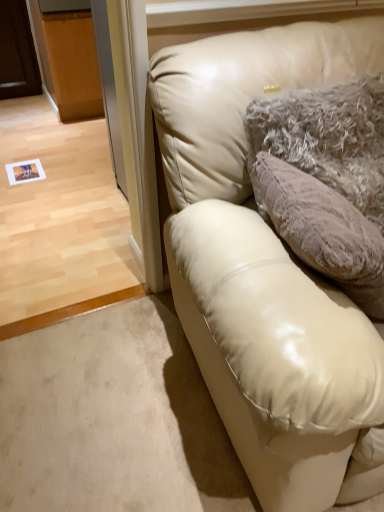
Question: Is fuzzy beige pillow at upper right to the left or to the right of matte cream leather couch at upper right in the image?

Choices:
 (A) left
 (B) right

Answer: (A)

Question: From their relative heights in the image, would you say fuzzy beige pillow at upper right is taller or shorter than matte cream leather couch at upper right?

Choices:
 (A) short
 (B) tall

Answer: (A)

Question: From a real-world perspective, is fuzzy beige pillow at upper right positioned above or below matte cream leather couch at upper right?

Choices:
 (A) below
 (B) above

Answer: (B)

Question: Considering the relative positions of matte cream leather couch at upper right and fuzzy beige pillow at upper right in the image provided, is matte cream leather couch at upper right to the left or to the right of fuzzy beige pillow at upper right?

Choices:
 (A) right
 (B) left

Answer: (A)

Question: Relative to fuzzy beige pillow at upper right, is matte cream leather couch at upper right in front or behind?

Choices:
 (A) behind
 (B) front

Answer: (B)

Question: Considering the positions of point (339, 78) and point (350, 195), is point (339, 78) closer or farther from the camera than point (350, 195)?

Choices:
 (A) farther
 (B) closer

Answer: (B)

Question: In terms of width, does matte cream leather couch at upper right look wider or thinner when compared to fuzzy beige pillow at upper right?

Choices:
 (A) thin
 (B) wide

Answer: (B)